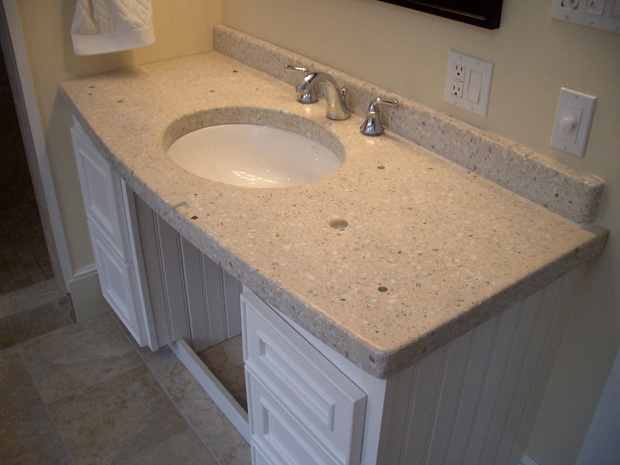
This screenshot has height=465, width=620. Identify the location of counter left of sink. (182, 90).